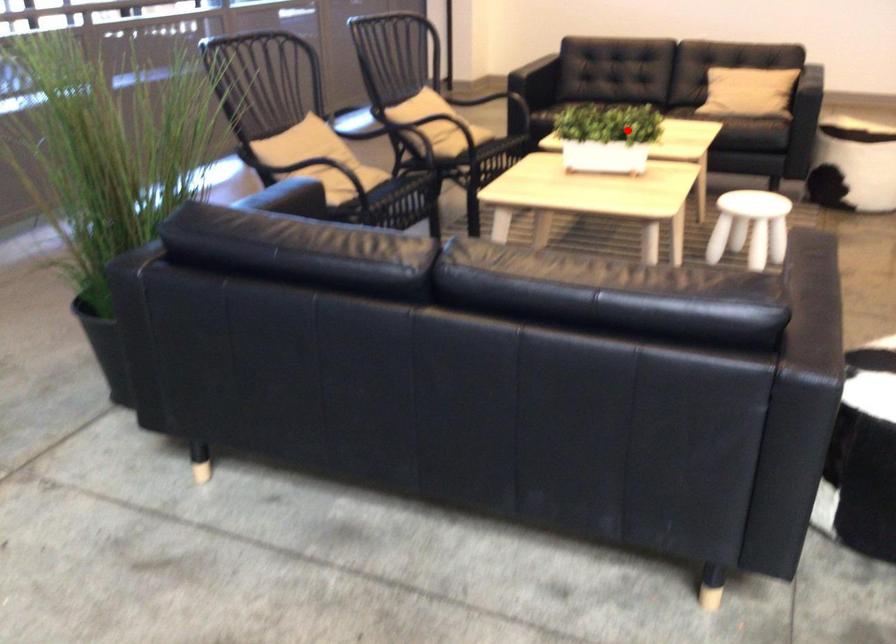
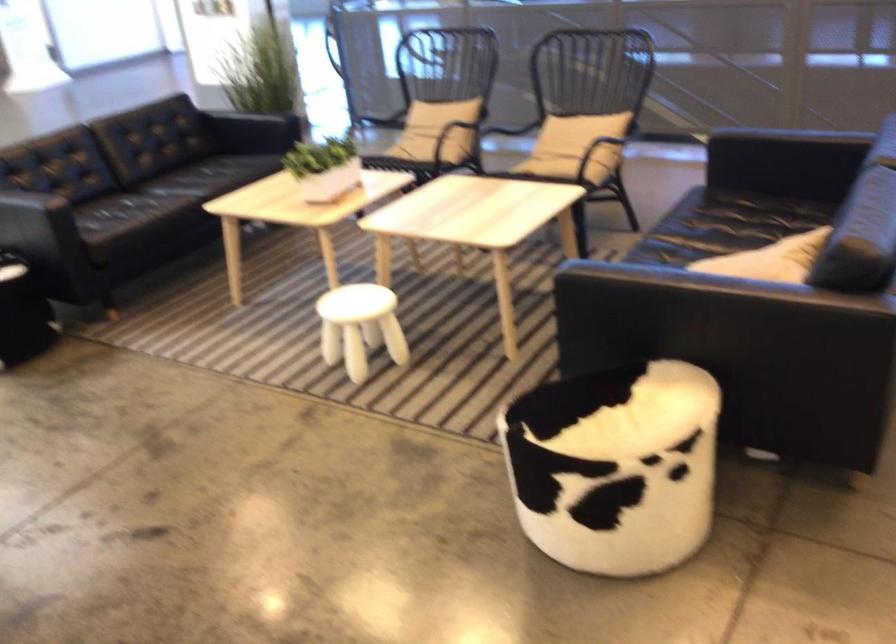
Question: I am providing you with two images of the same scene from different viewpoints. A red point is marked on the first image. At the location where the point appears in image 1, is it still visible in image 2?

Choices:
 (A) Yes
 (B) No

Answer: (A)